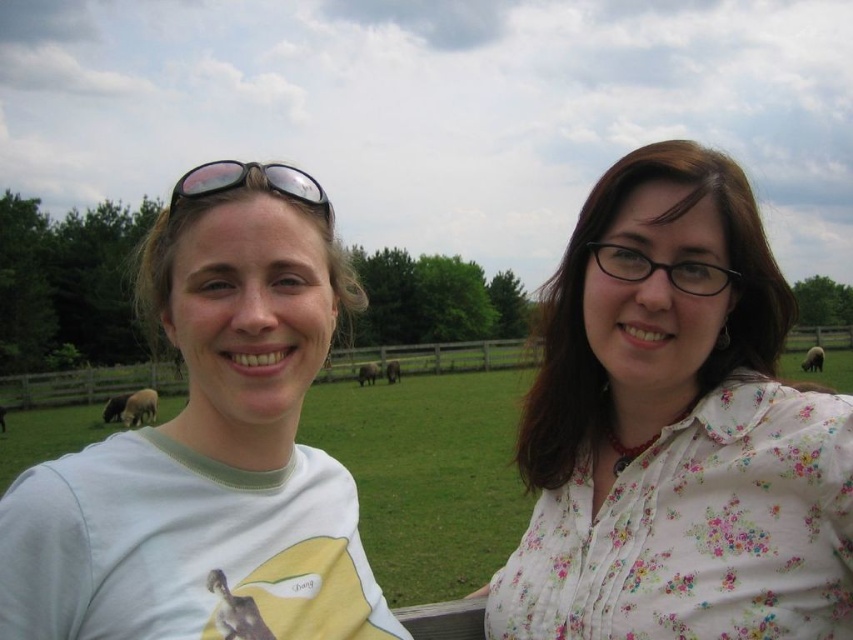
You are standing in a rural setting with two people in front of you. You need to hand a document to the person wearing the floral cotton blouse at upper right. Given that you are 1.7 meters tall and the document is at your waist level, can you reach the person without moving closer?

The floral cotton blouse at upper right is 4.37 meters away from the viewer. Since the average arm span is about 1.5 to 1.8 meters, you cannot reach the person without moving closer.

You are taking a photo of two people standing in a rural setting. You notice two points in the image at coordinates point (541, 589) and point (215, 180). Which point is closer to the camera?

Point (541, 589) is further to the camera than point (215, 180), so the closer point to the camera is point (215, 180).